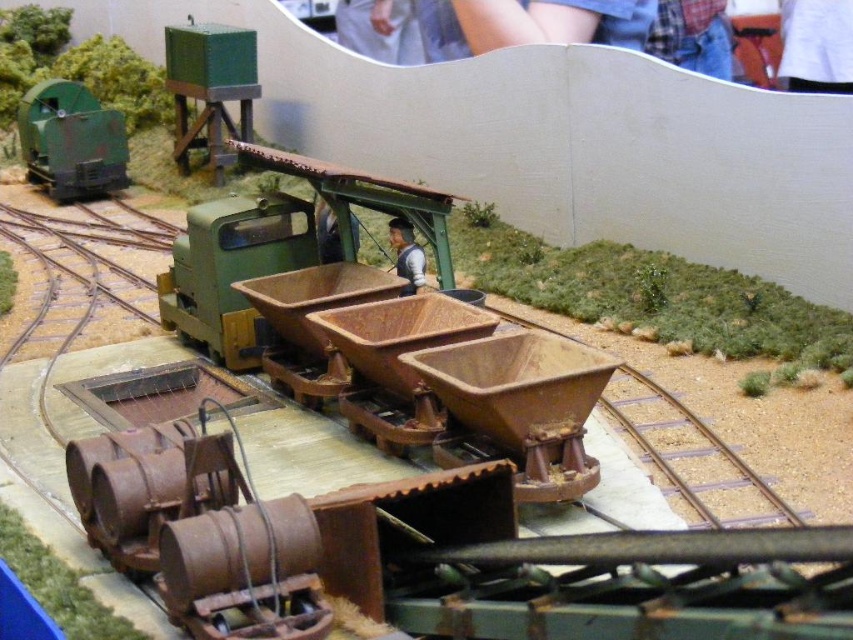
Question: Can you confirm if rusty metal train track at center is bigger than matte green train at left?

Choices:
 (A) no
 (B) yes

Answer: (A)

Question: Can you confirm if rusty metal train track at center is positioned below matte green train at left?

Choices:
 (A) no
 (B) yes

Answer: (B)

Question: Can you confirm if rusty metal train track at center is smaller than matte green train at left?

Choices:
 (A) yes
 (B) no

Answer: (A)

Question: Which point appears closest to the camera in this image?

Choices:
 (A) (519, 556)
 (B) (109, 141)

Answer: (A)